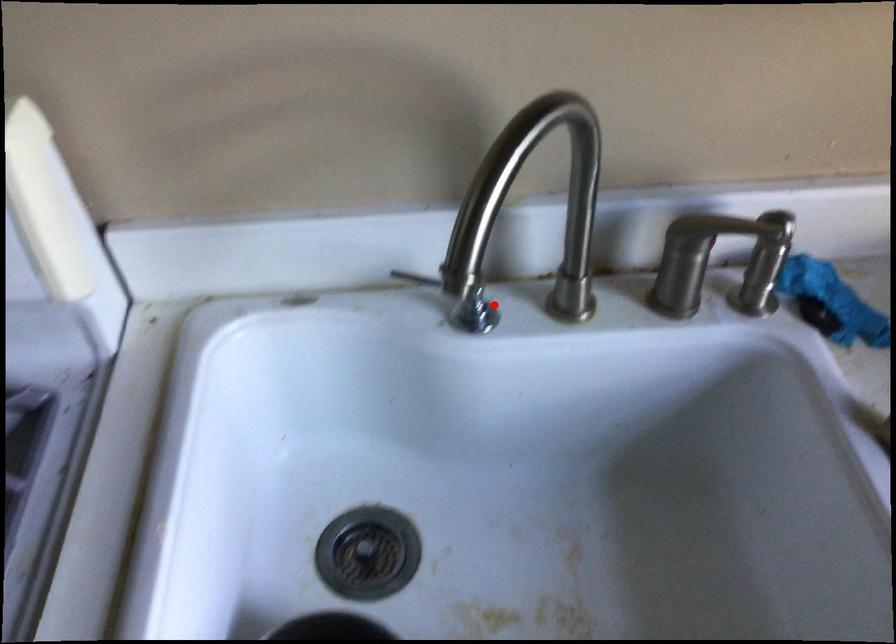
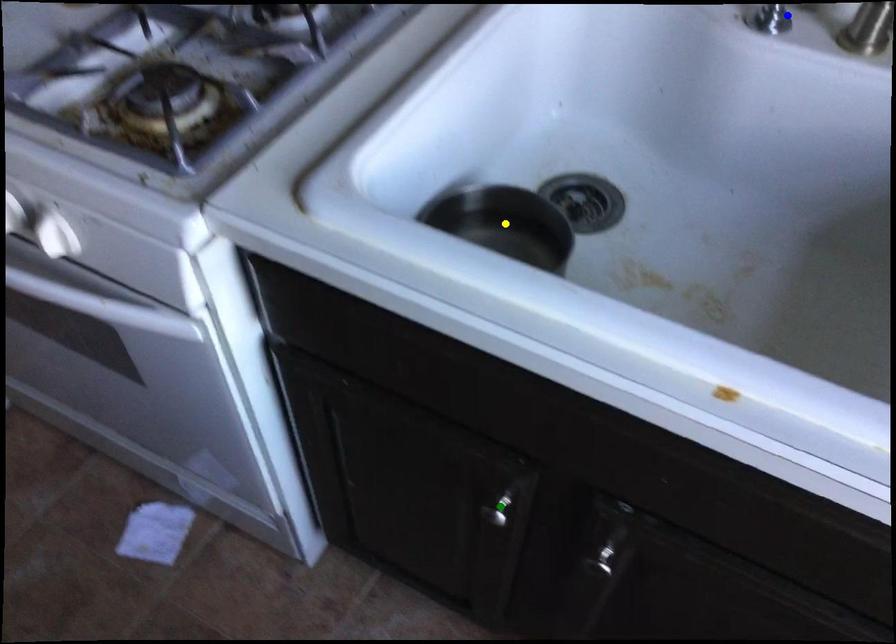
Question: I am providing you with two images of the same scene from different viewpoints. A red point is marked on the first image. You are given multiple points on the second image. Which point in image 2 is actually the same real-world point as the red point in image 1?

Choices:
 (A) yellow point
 (B) green point
 (C) blue point

Answer: (C)